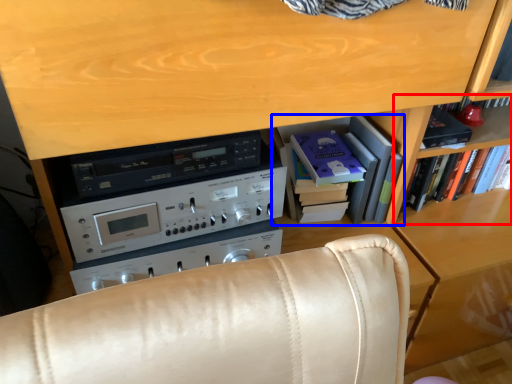
Question: Which of the following is the closest to the observer, shelf (highlighted by a red box) or shelf (highlighted by a blue box)?

Choices:
 (A) shelf
 (B) shelf

Answer: (B)